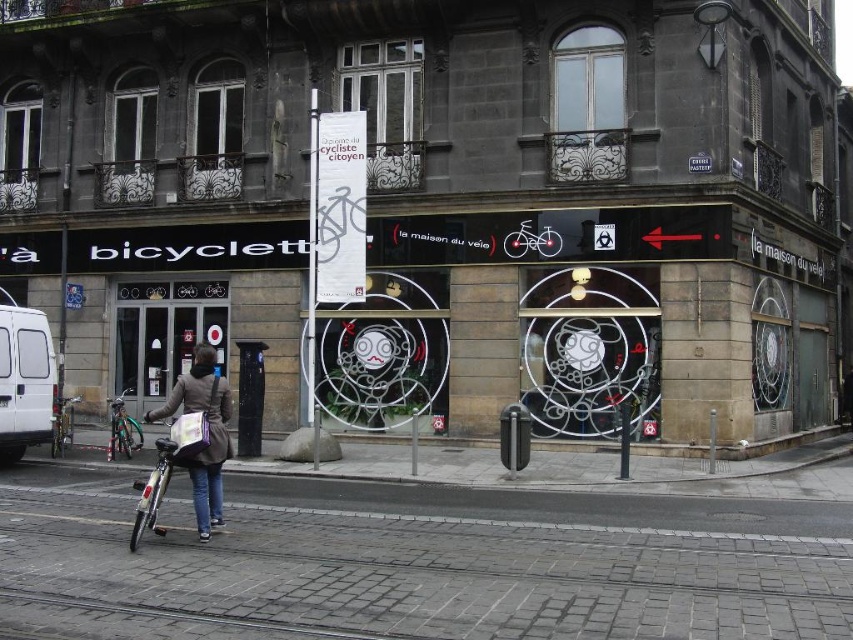
You are a delivery person who needs to park your silver metallic bicycle at lower left near the shop. However, there is a white matte van at lower left blocking the path. Can you easily move the bicycle around the van?

The white matte van at lower left is located above the silver metallic bicycle at lower left, meaning the van is parked higher up and not directly blocking the path. Therefore, you can easily move the bicycle around the van.

You are standing at the street corner and want to determine which of the two points, point (32, 433) or point (119, 422), is closer to you. Based on the scene, which point is nearer?

Point (32, 433) is closer to the viewer than point (119, 422).